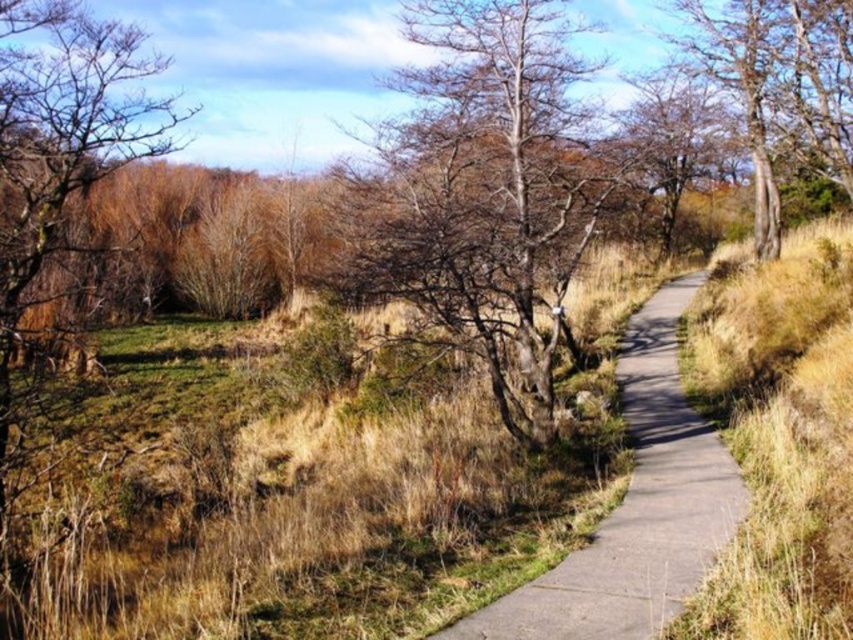
Question: Does bare branches at left appear over bare wood tree at upper right?

Choices:
 (A) no
 (B) yes

Answer: (A)

Question: Which of the following is the closest to the observer?

Choices:
 (A) concrete at center
 (B) bare branches at left
 (C) bare branches at center
 (D) bare wood tree at upper right

Answer: (A)

Question: Which object is the closest to the bare branches at left?

Choices:
 (A) bare branches at center
 (B) bare wood tree at upper right

Answer: (A)

Question: Does concrete at center appear on the right side of bare wood tree at upper right?

Choices:
 (A) no
 (B) yes

Answer: (A)

Question: Which object is closer to the camera taking this photo?

Choices:
 (A) bare branches at left
 (B) concrete at center
 (C) bare wood tree at upper right
 (D) bare branches at center

Answer: (B)

Question: Can you confirm if bare branches at center is positioned above bare wood tree at upper right?

Choices:
 (A) yes
 (B) no

Answer: (B)